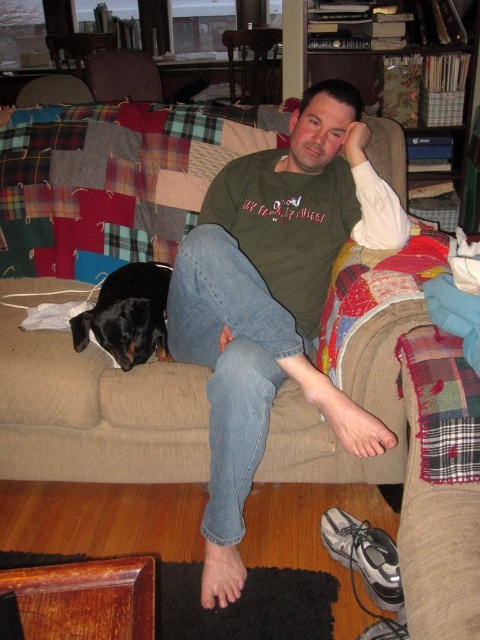
Based on the scene description, where is the green cotton shirt at center located in terms of coordinates?

The green cotton shirt at center is located at coordinates point (274, 300).

You are a delivery person who needs to place a small package between the beige fabric couch at center and the black smooth dog at lower left. The package is 10 inches long. Is there enough space between them to fit the package?

The beige fabric couch at center is 8.75 inches from the black smooth dog at lower left. Since the package is 10 inches long, it is longer than the available space between them. Therefore, the package cannot fit between the beige fabric couch at center and the black smooth dog at lower left.

You are standing in front of the couch and want to hand the green cotton shirt at center to someone behind you. Can you reach it without moving your feet?

The green cotton shirt at center is 1.29 meters away from the camera, so you can easily reach it without moving your feet.